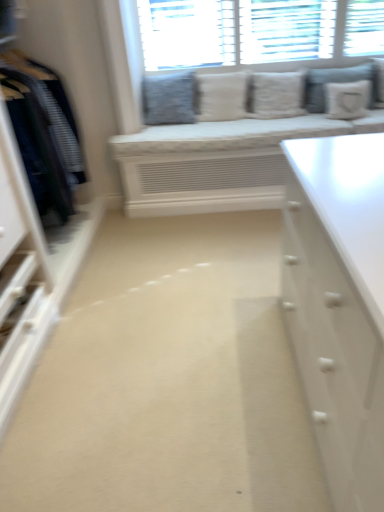
Question: Does white textured pillow at center, acting as the 3th pillow starting from the right, have a lesser height compared to white textured pillow at center, which is counted as the 4th pillow, starting from the right?

Choices:
 (A) no
 (B) yes

Answer: (A)

Question: Is white textured pillow at center, which ranks as the third pillow in left-to-right order, outside of white textured pillow at center, which is counted as the 4th pillow, starting from the right?

Choices:
 (A) yes
 (B) no

Answer: (A)

Question: Is white textured pillow at center, which ranks as the third pillow in left-to-right order, beside white textured pillow at center, the second pillow from the left?

Choices:
 (A) no
 (B) yes

Answer: (A)

Question: From a real-world perspective, is white textured pillow at center, acting as the 3th pillow starting from the right, under white textured pillow at center, which is counted as the 4th pillow, starting from the right?

Choices:
 (A) no
 (B) yes

Answer: (A)

Question: Does white textured pillow at center, acting as the 3th pillow starting from the right, lie in front of white textured pillow at center, which is counted as the 4th pillow, starting from the right?

Choices:
 (A) yes
 (B) no

Answer: (A)

Question: Is point (264, 102) positioned closer to the camera than point (235, 240)?

Choices:
 (A) closer
 (B) farther

Answer: (B)

Question: Considering the positions of white textured pillow at center, which ranks as the third pillow in left-to-right order, and beige carpet at center in the image, is white textured pillow at center, which ranks as the third pillow in left-to-right order, wider or thinner than beige carpet at center?

Choices:
 (A) wide
 (B) thin

Answer: (B)

Question: In the image, is white textured pillow at center, acting as the 3th pillow starting from the right, positioned in front of or behind beige carpet at center?

Choices:
 (A) front
 (B) behind

Answer: (B)

Question: Based on their sizes in the image, would you say white textured pillow at center, acting as the 3th pillow starting from the right, is bigger or smaller than beige carpet at center?

Choices:
 (A) small
 (B) big

Answer: (A)

Question: Is point (231, 78) closer or farther from the camera than point (337, 97)?

Choices:
 (A) closer
 (B) farther

Answer: (B)

Question: In terms of height, does white textured pillow at center, which is counted as the 4th pillow, starting from the right, look taller or shorter compared to white fabric pillow at upper right, the fifth pillow when ordered from left to right?

Choices:
 (A) tall
 (B) short

Answer: (A)

Question: In terms of width, does white textured pillow at center, which is counted as the 4th pillow, starting from the right, look wider or thinner when compared to white fabric pillow at upper right, placed as the first pillow when sorted from right to left?

Choices:
 (A) wide
 (B) thin

Answer: (A)

Question: From a real-world perspective, is white textured pillow at center, which is counted as the 4th pillow, starting from the right, physically located above or below white fabric pillow at upper right, the fifth pillow when ordered from left to right?

Choices:
 (A) below
 (B) above

Answer: (B)

Question: Is white textured pillow at center, the second pillow from the left, in front of or behind white textured pillows at upper center in the image?

Choices:
 (A) behind
 (B) front

Answer: (A)

Question: Is white textured pillow at center, the second pillow from the left, inside the boundaries of white textured pillows at upper center, or outside?

Choices:
 (A) inside
 (B) outside

Answer: (B)